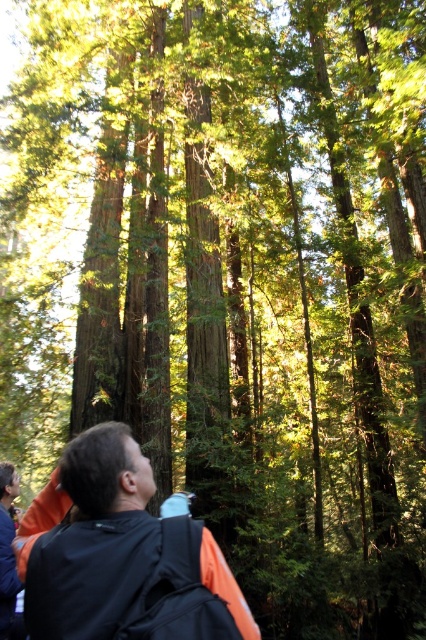
Question: Is orange fabric backpack at lower center further to the viewer compared to orange fabric jacket at lower left?

Choices:
 (A) yes
 (B) no

Answer: (B)

Question: Among these points, which one is nearest to the camera?

Choices:
 (A) (180, 536)
 (B) (8, 557)

Answer: (A)

Question: From the image, what is the correct spatial relationship of orange fabric backpack at lower center in relation to orange fabric jacket at lower left?

Choices:
 (A) below
 (B) above

Answer: (B)

Question: Does orange fabric backpack at lower center appear on the left side of orange fabric jacket at lower left?

Choices:
 (A) yes
 (B) no

Answer: (B)

Question: Which point is farther to the camera?

Choices:
 (A) (85, 628)
 (B) (8, 467)

Answer: (B)